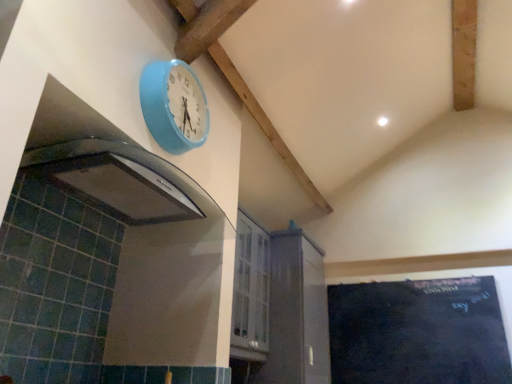
Question: Is white glossy cabinet at center far from black chalkboard at lower right?

Choices:
 (A) yes
 (B) no

Answer: (B)

Question: Considering the relative positions of white glossy cabinet at center and black chalkboard at lower right in the image provided, is white glossy cabinet at center to the right of black chalkboard at lower right from the viewer's perspective?

Choices:
 (A) no
 (B) yes

Answer: (A)

Question: Considering the relative sizes of white glossy cabinet at center and black chalkboard at lower right in the image provided, is white glossy cabinet at center smaller than black chalkboard at lower right?

Choices:
 (A) yes
 (B) no

Answer: (B)

Question: Can we say white glossy cabinet at center lies outside black chalkboard at lower right?

Choices:
 (A) no
 (B) yes

Answer: (B)

Question: Is the position of white glossy cabinet at center less distant than that of black chalkboard at lower right?

Choices:
 (A) yes
 (B) no

Answer: (A)

Question: Does white glossy cabinet at center appear on the left side of black chalkboard at lower right?

Choices:
 (A) yes
 (B) no

Answer: (A)

Question: Is white glossy cabinet at center taller than light blue plastic clock at upper center?

Choices:
 (A) yes
 (B) no

Answer: (A)

Question: From a real-world perspective, is white glossy cabinet at center physically above light blue plastic clock at upper center?

Choices:
 (A) no
 (B) yes

Answer: (A)

Question: Could you tell me if white glossy cabinet at center is turned towards light blue plastic clock at upper center?

Choices:
 (A) no
 (B) yes

Answer: (A)

Question: Does white glossy cabinet at center have a smaller size compared to light blue plastic clock at upper center?

Choices:
 (A) no
 (B) yes

Answer: (A)

Question: Does white glossy cabinet at center have a larger size compared to light blue plastic clock at upper center?

Choices:
 (A) yes
 (B) no

Answer: (A)

Question: Does white glossy cabinet at center have a lesser height compared to light blue plastic clock at upper center?

Choices:
 (A) no
 (B) yes

Answer: (A)

Question: Is black chalkboard at lower right to the right of light blue plastic clock at upper center from the viewer's perspective?

Choices:
 (A) yes
 (B) no

Answer: (A)